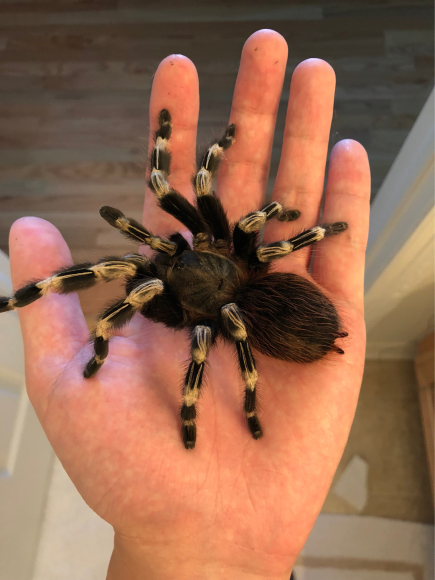
Where is `doorframe`? This screenshot has height=580, width=435. doorframe is located at coordinates (422, 168).